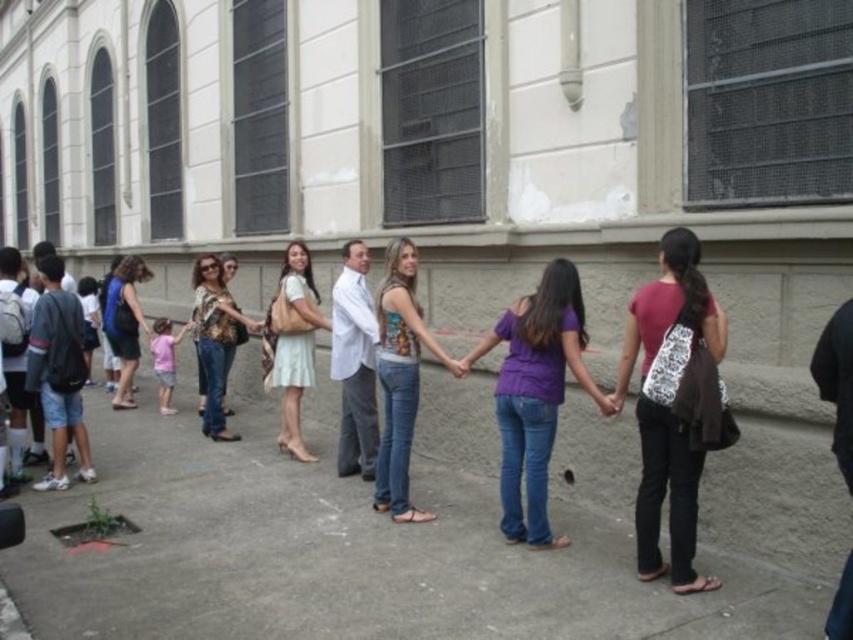
Question: Does gray concrete pavement at center have a smaller size compared to pink fabric shirt at lower left?

Choices:
 (A) yes
 (B) no

Answer: (A)

Question: Is gray concrete pavement at center smaller than printed fabric tank top at center?

Choices:
 (A) no
 (B) yes

Answer: (B)

Question: Which object is the closest to the maroon fabric shirt at center?

Choices:
 (A) blue denim jeans at left
 (B) purple matte shirt at center
 (C) gray concrete pavement at center

Answer: (B)

Question: Does maroon fabric shirt at center come behind pink fabric shirt at lower left?

Choices:
 (A) yes
 (B) no

Answer: (B)

Question: Based on their relative distances, which object is farther from the gray concrete pavement at center?

Choices:
 (A) purple matte shirt at center
 (B) printed fabric blouse at center
 (C) blue denim jeans at left

Answer: (C)

Question: Which point is closer to the camera?

Choices:
 (A) (287, 266)
 (B) (109, 289)
 (C) (393, 419)
 (D) (680, 285)

Answer: (D)